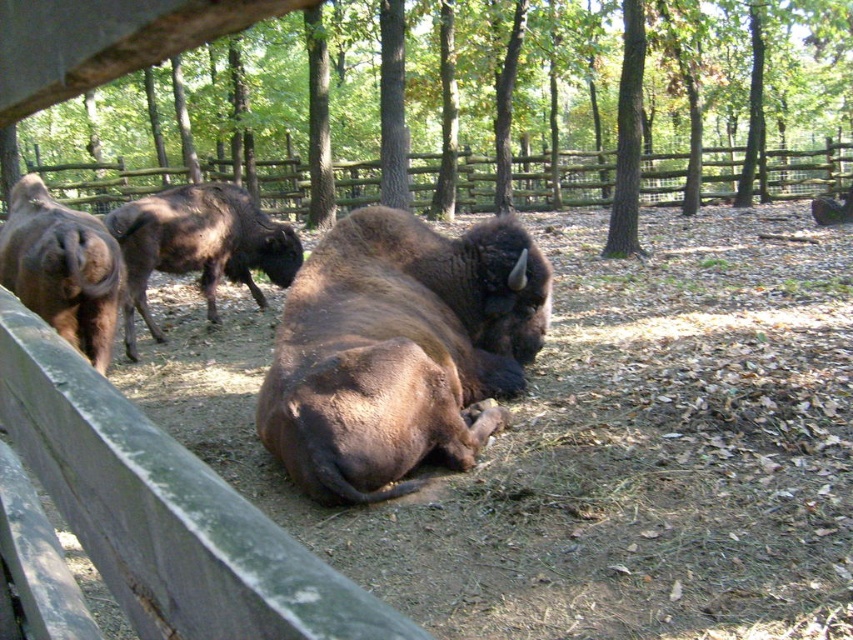
Does brown furry bison at center lie in front of wooden fence at center?

Yes, it is in front of wooden fence at center.

Which is more to the right, brown furry bison at center or wooden fence at center?

wooden fence at center

Which is behind, point (471, 296) or point (294, 166)?

Positioned behind is point (294, 166).

At what (x,y) coordinates should I click in order to perform the action: click on brown furry bison at center. Please return your answer as a coordinate pair (x, y). Looking at the image, I should click on coord(398,349).

What do you see at coordinates (563, 179) in the screenshot? Image resolution: width=853 pixels, height=640 pixels. I see `wooden fence at center` at bounding box center [563, 179].

Can you confirm if wooden fence at center is bigger than brown shaggy bison at upper left?

Indeed, wooden fence at center has a larger size compared to brown shaggy bison at upper left.

This screenshot has width=853, height=640. I want to click on wooden fence at center, so click(563, 179).

Does brown shaggy bison at upper left lie in front of brown furry bison at left?

No, it is not.

Does brown shaggy bison at upper left appear on the right side of brown furry bison at left?

Correct, you'll find brown shaggy bison at upper left to the right of brown furry bison at left.

Which is behind, point (250, 264) or point (45, 262)?

Point (250, 264)

Where is `brown shaggy bison at upper left`? The image size is (853, 640). brown shaggy bison at upper left is located at coordinates (198, 244).